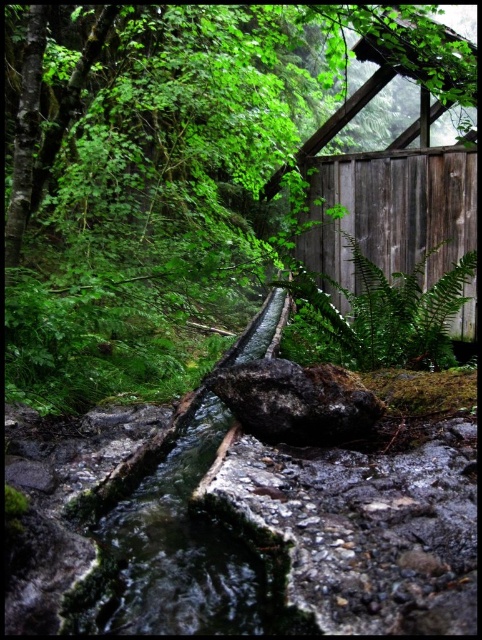
You are a hiker who wants to place a small backpack between the green leafy fern at center and the rough textured rock at center. Which object should you place the backpack closer to if you want to ensure the backpack doesn

The green leafy fern at center is wider than the rough textured rock at center. To ensure the backpack fits, you should place it closer to the rough textured rock at center since it has a narrower width.

You are a hiker who wants to cross the stream safely. You see a green leafy fern at center and a rough textured rock at center. Which object is closer to you as you stand at the edge of the stream?

The green leafy fern at center and rough textured rock at center are 4.14 feet apart, but the question does not specify which is closer. The answer cannot be determined with the given information.

You are a hiker who wants to cross the stream safely. You see the rough textured rock at center and the green leafy fern at center. Which object is closer to you as you stand on the bank?

The green leafy fern at center is closer to you because the rough textured rock at center is behind it.